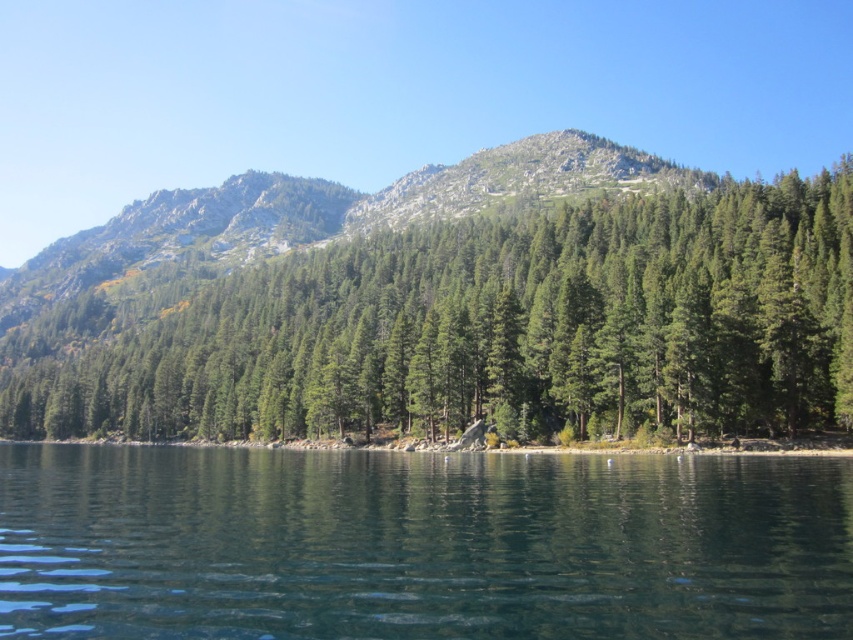
Question: Based on their relative distances, which object is nearer to the green textured forest at center?

Choices:
 (A) green smooth water at center
 (B) green matte tree at center

Answer: (B)

Question: Is green smooth water at center to the right of green textured forest at center from the viewer's perspective?

Choices:
 (A) yes
 (B) no

Answer: (A)

Question: Estimate the real-world distances between objects in this image. Which object is farther from the green textured forest at center?

Choices:
 (A) green matte tree at center
 (B) green smooth water at center

Answer: (B)

Question: Is green matte tree at center bigger than green textured forest at center?

Choices:
 (A) no
 (B) yes

Answer: (A)

Question: Does green matte tree at center appear over green textured forest at center?

Choices:
 (A) yes
 (B) no

Answer: (B)

Question: Which object is positioned closest to the green matte tree at center?

Choices:
 (A) green textured forest at center
 (B) green smooth water at center

Answer: (A)